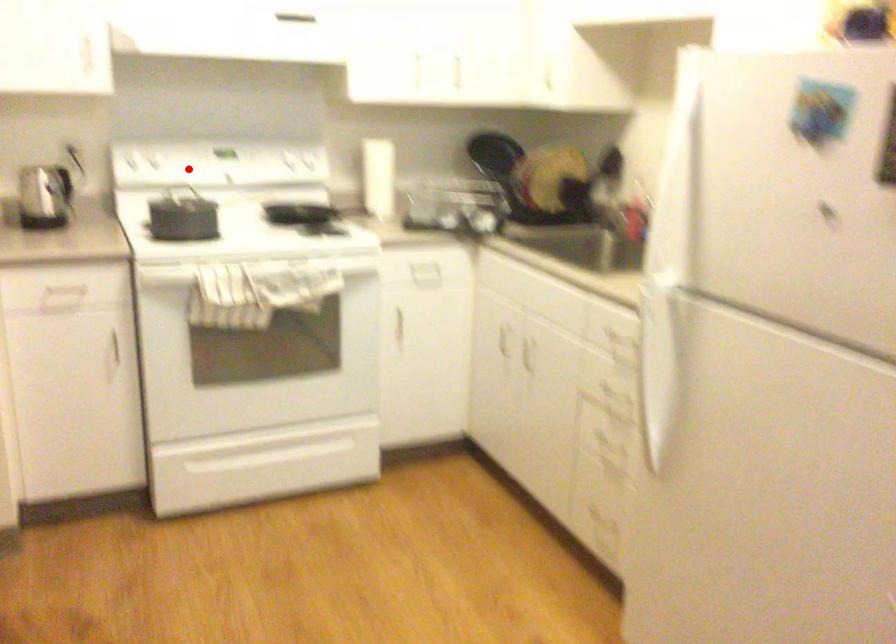
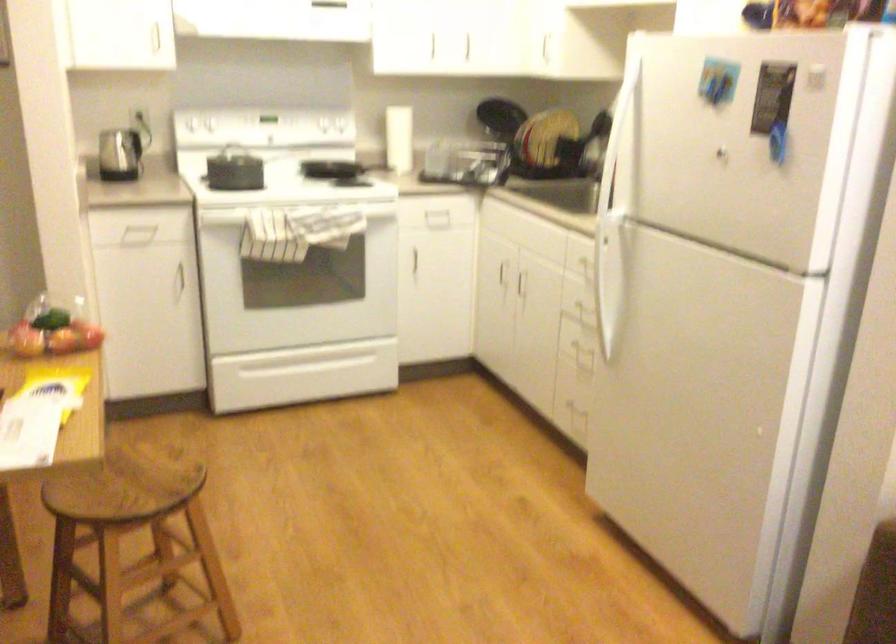
In the second image, find the point that corresponds to the highlighted location in the first image.

(234, 125)